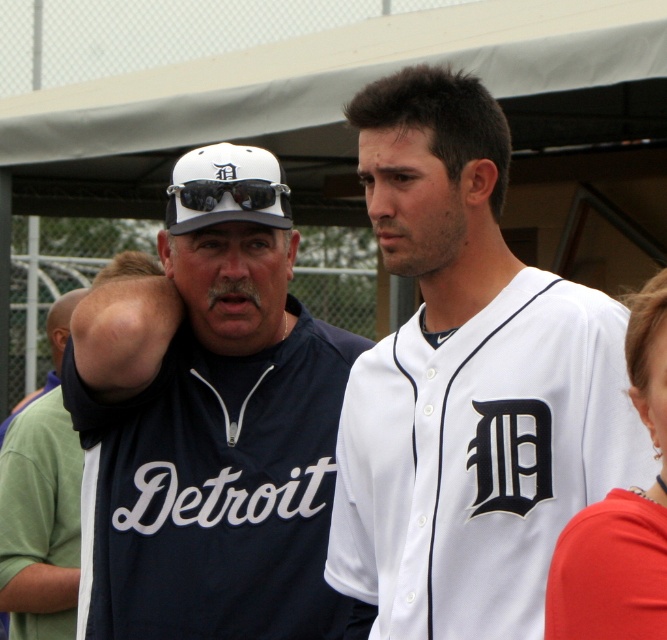
Question: Is matte red shirt at right in front of white matte baseball cap at upper center?

Choices:
 (A) no
 (B) yes

Answer: (B)

Question: Can you confirm if white jersey at center is positioned above white matte baseball cap at upper center?

Choices:
 (A) no
 (B) yes

Answer: (A)

Question: Based on their relative distances, which object is nearer to the matte red shirt at right?

Choices:
 (A) navy blue jersey at left
 (B) white jersey at center
 (C) white matte baseball cap at upper center
 (D) green jersey at left

Answer: (B)

Question: Does white jersey at center have a greater width compared to green jersey at left?

Choices:
 (A) no
 (B) yes

Answer: (B)

Question: Which is nearer to the green jersey at left?

Choices:
 (A) matte red shirt at right
 (B) navy blue jersey at left
 (C) white matte baseball cap at upper center

Answer: (B)

Question: Which object appears closest to the camera in this image?

Choices:
 (A) white matte baseball cap at upper center
 (B) navy blue jersey at left

Answer: (B)